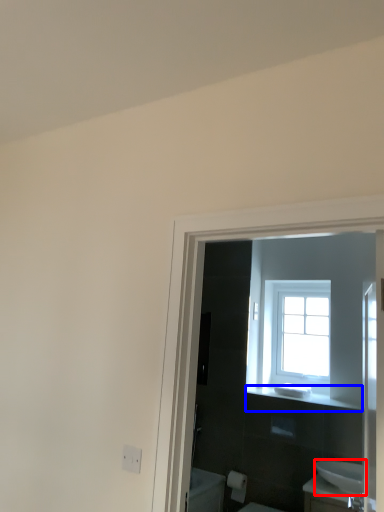
Question: Which point is closer to the camera, sink (highlighted by a red box) or balustrade (highlighted by a blue box)?

Choices:
 (A) sink
 (B) balustrade

Answer: (A)